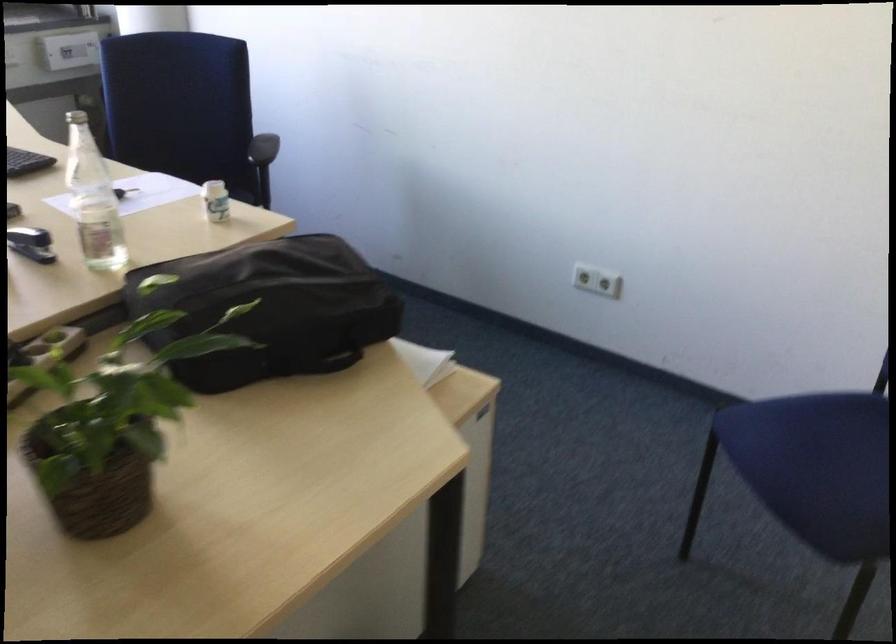
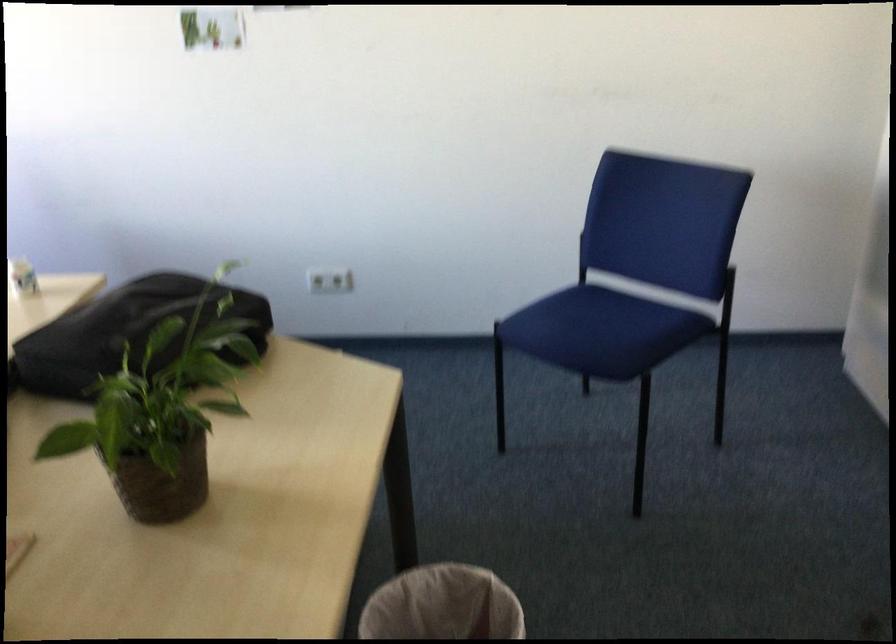
Locate, in the second image, the point that corresponds to the point at 122,428 in the first image.

(162, 413)